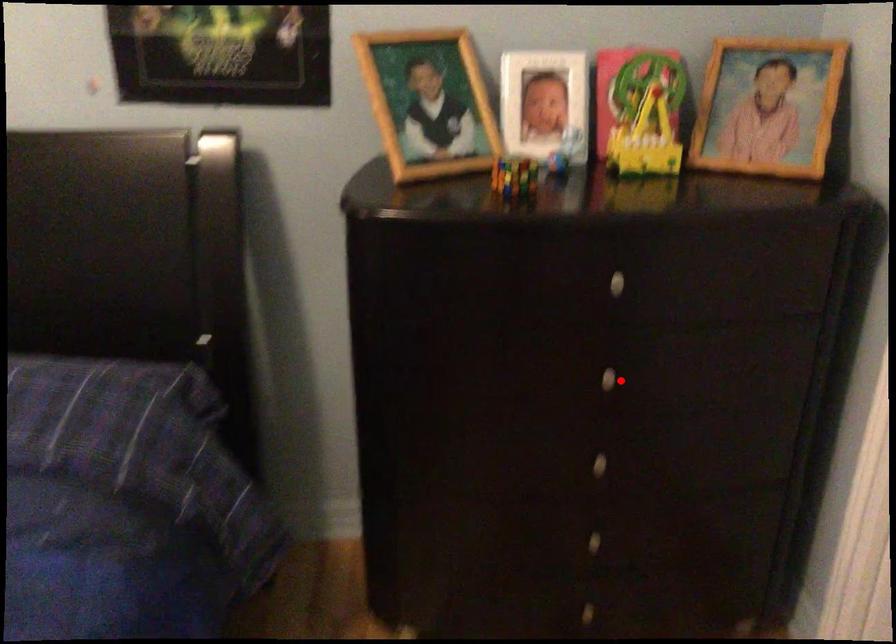
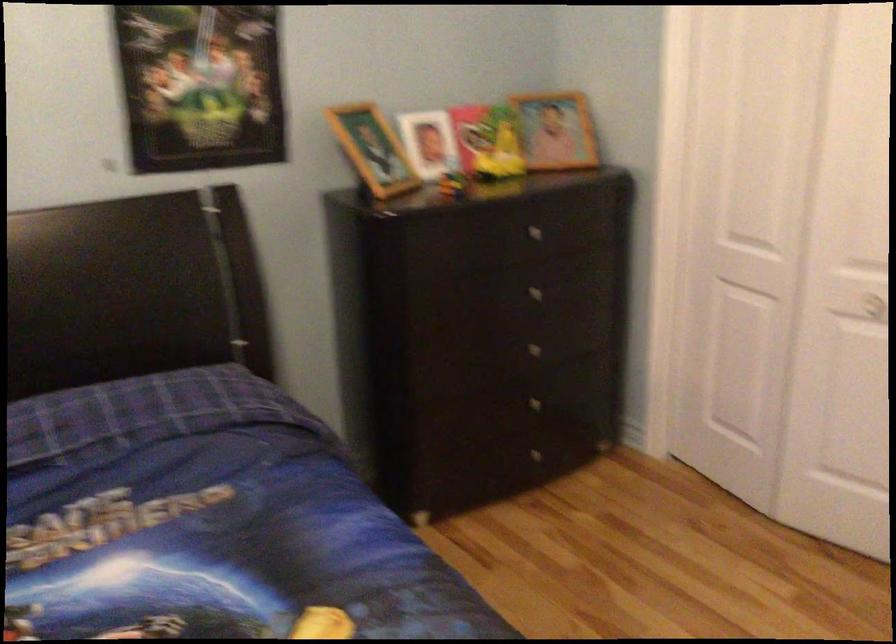
Question: A red point is marked in image1. In image2, is the corresponding 3D point closer to the camera or farther? Reply with the corresponding letter.

Choices:
 (A) The corresponding 3D point is closer.
 (B) The corresponding 3D point is farther.

Answer: (B)